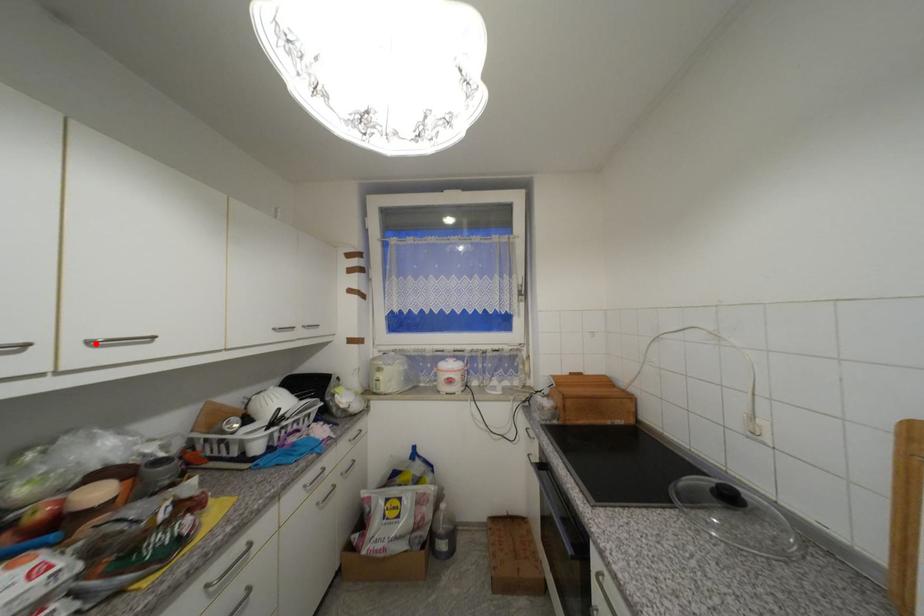
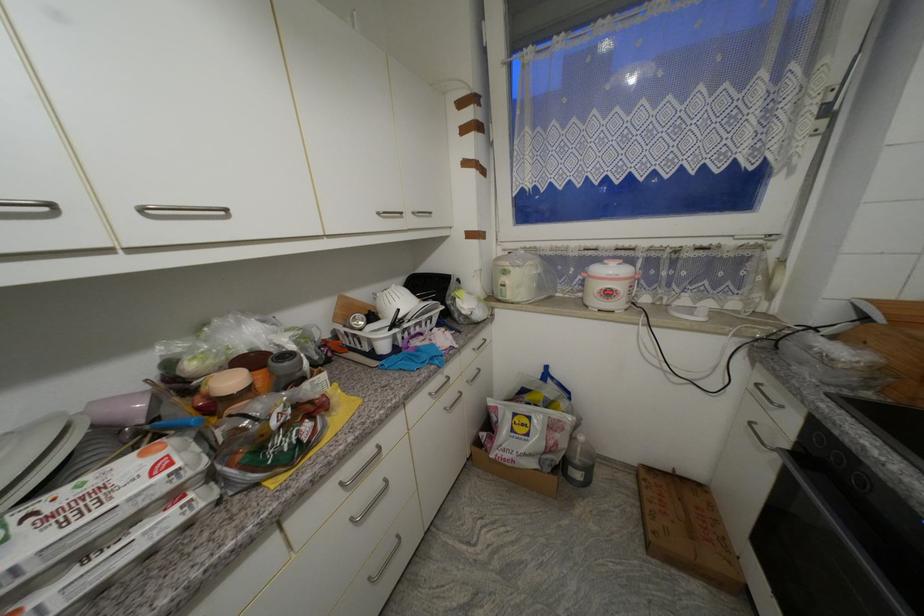
Question: I am providing you with two images of the same scene from different viewpoints. A red point is marked on the first image. At the location where the point appears in image 1, is it still visible in image 2?

Choices:
 (A) Yes
 (B) No

Answer: (A)